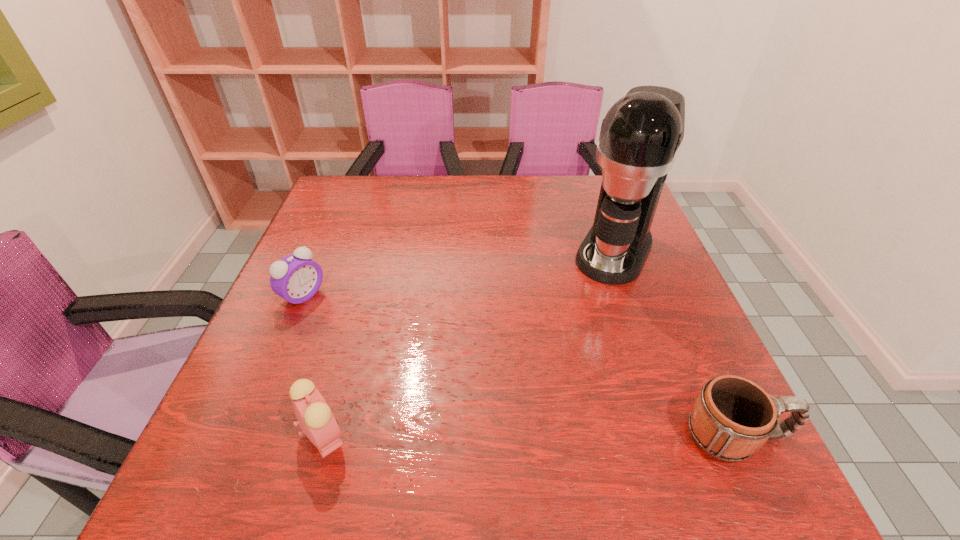
You are a GUI agent. You are given a task and a screenshot of the screen. Output one action in this format:
    pyautogui.click(x=<x>, y=<y>)
    Task: Click on the free space on the desktop that is between the nearer alarm clock and the mug and is positioned place cup under the spout of the coffee maker
    The image size is (960, 540).
    Given the screenshot: What is the action you would take?
    pyautogui.click(x=517, y=435)

You are a GUI agent. You are given a task and a screenshot of the screen. Output one action in this format:
    pyautogui.click(x=<x>, y=<y>)
    Task: Click on the vacant space on the desktop that is between the right alarm clock and the mug and is positioned on the face of the leftmost object
    The image size is (960, 540).
    Given the screenshot: What is the action you would take?
    pyautogui.click(x=526, y=435)